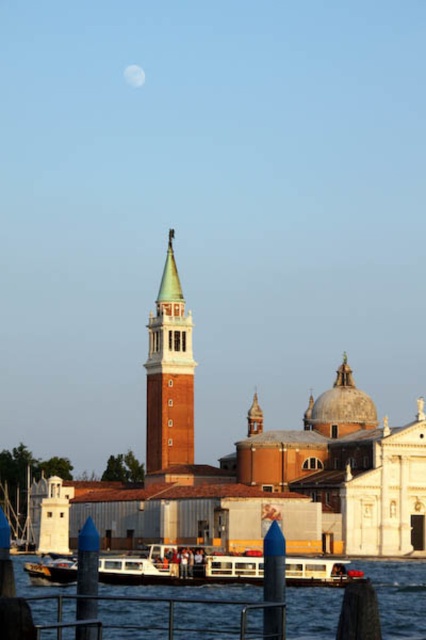
Is point (175, 570) farther from camera compared to point (45, 563)?

No, (175, 570) is closer to viewer.

Which is below, white matte boat at center or wooden polished boat at lower left?

wooden polished boat at lower left is below.

Between point (291, 561) and point (49, 572), which one is positioned behind?

The point (49, 572) is behind.

You are a GUI agent. You are given a task and a screenshot of the screen. Output one action in this format:
    pyautogui.click(x=<x>, y=<y>)
    Task: Click on the white matte boat at center
    This screenshot has height=640, width=426.
    Given the screenshot: What is the action you would take?
    pyautogui.click(x=181, y=566)

Is brick steeple at center further to the viewer compared to white matte boat at center?

Yes, it is.

From the picture: Is brick steeple at center bigger than white matte boat at center?

Correct, brick steeple at center is larger in size than white matte boat at center.

Between point (163, 429) and point (233, 563), which one is positioned behind?

Point (163, 429)

The height and width of the screenshot is (640, 426). I want to click on brick steeple at center, so click(x=169, y=374).

Which of these two, smooth water at center or white matte boat at center, stands shorter?

Standing shorter between the two is smooth water at center.

Does smooth water at center appear over white matte boat at center?

No, smooth water at center is not above white matte boat at center.

What are the coordinates of `smooth water at center` in the screenshot? It's located at (399, 596).

Where is `smooth water at center`? smooth water at center is located at coordinates (399, 596).